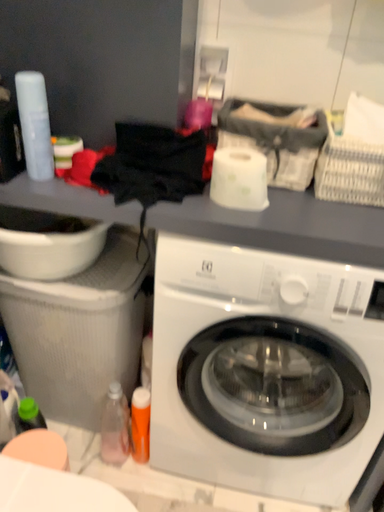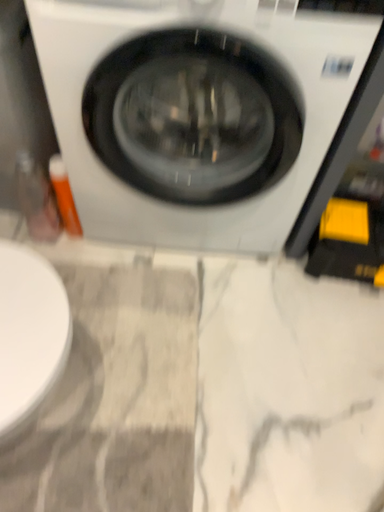
Question: Which way did the camera rotate in the video?

Choices:
 (A) rotated upward
 (B) rotated downward

Answer: (B)